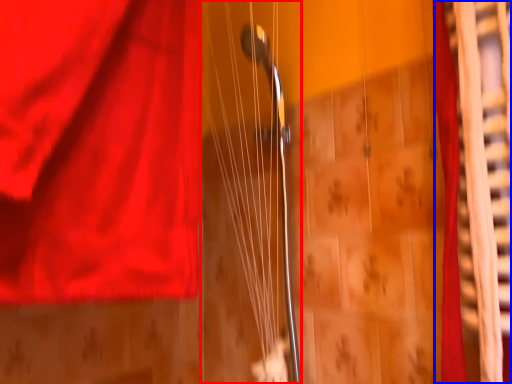
Question: Which of the following is the farthest to the observer, string (highlighted by a red box) or curtain (highlighted by a blue box)?

Choices:
 (A) string
 (B) curtain

Answer: (A)